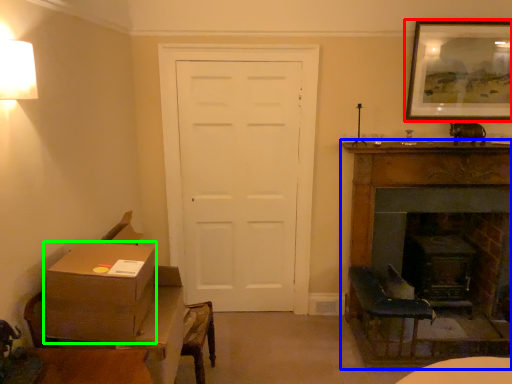
Question: Based on their relative distances, which object is farther from picture frame (highlighted by a red box)? Choose from fireplace (highlighted by a blue box) and box (highlighted by a green box).

Choices:
 (A) fireplace
 (B) box

Answer: (B)